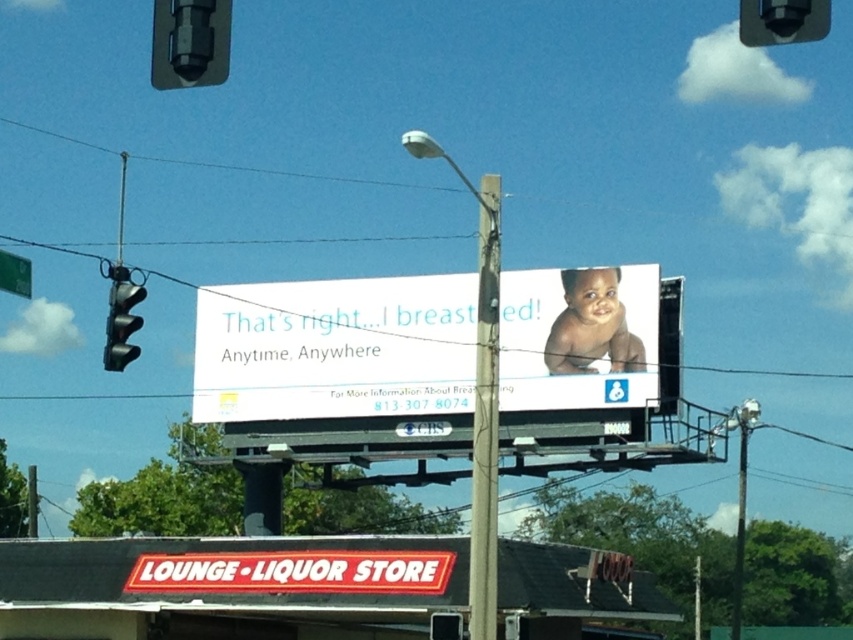
Can you confirm if matte white billboard at center is positioned above green plastic street sign at upper left?

No, matte white billboard at center is not above green plastic street sign at upper left.

You are a GUI agent. You are given a task and a screenshot of the screen. Output one action in this format:
    pyautogui.click(x=<x>, y=<y>)
    Task: Click on the matte white billboard at center
    The image size is (853, 640).
    Given the screenshot: What is the action you would take?
    pyautogui.click(x=335, y=348)

Is point (461, 353) less distant than point (30, 291)?

No.

This screenshot has height=640, width=853. I want to click on matte white billboard at center, so click(335, 348).

Can you confirm if smooth skin baby at center is positioned below black plastic traffic light at left?

Correct, smooth skin baby at center is located below black plastic traffic light at left.

Is point (625, 349) farther from viewer compared to point (117, 348)?

Yes, point (625, 349) is farther from viewer.

Does point (598, 355) come in front of point (120, 353)?

No.

Find the location of a particular element. The width and height of the screenshot is (853, 640). smooth skin baby at center is located at coordinates (590, 324).

Does metallic gray pole at center appear under green plastic street sign at upper left?

Yes.

Find the location of `metallic gray pole at center`. metallic gray pole at center is located at coordinates (740, 531).

The image size is (853, 640). Find the location of `metallic gray pole at center`. metallic gray pole at center is located at coordinates (740, 531).